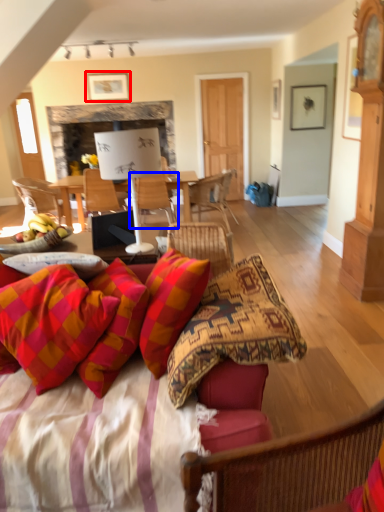
Question: Which of the following is the closest to the observer, picture frame (highlighted by a red box) or chair (highlighted by a blue box)?

Choices:
 (A) picture frame
 (B) chair

Answer: (B)